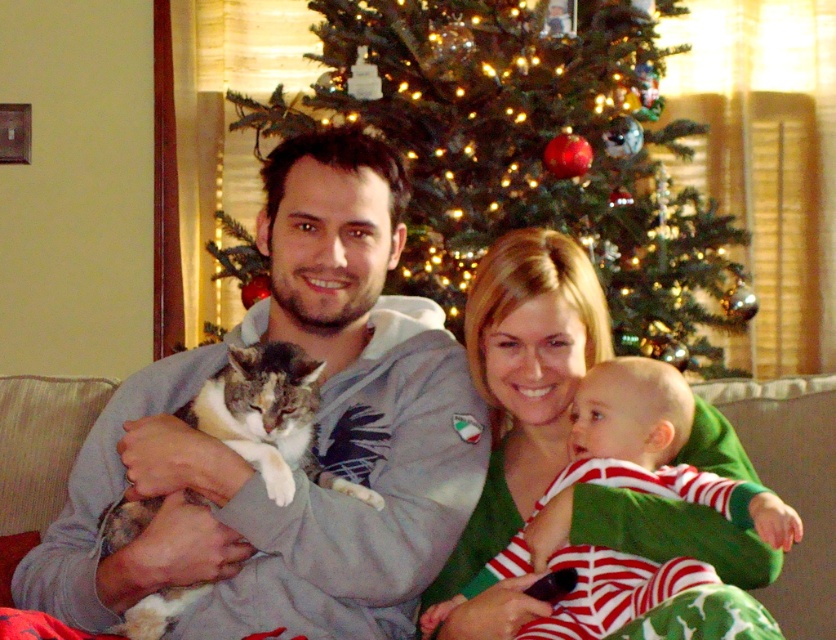
Question: Which point is farther to the camera?

Choices:
 (A) (682, 120)
 (B) (268, 451)
 (C) (67, 566)

Answer: (A)

Question: Which of the following is the closest to the observer?

Choices:
 (A) gray hoodie at center
 (B) calico fur cat at center

Answer: (B)

Question: From the image, what is the correct spatial relationship of green textured christmas tree at center in relation to striped cotton onesie at center?

Choices:
 (A) above
 (B) below

Answer: (A)

Question: Is green textured christmas tree at center above striped cotton onesie at center?

Choices:
 (A) no
 (B) yes

Answer: (B)

Question: Which point is farther to the camera?

Choices:
 (A) (697, 500)
 (B) (253, 342)
 (C) (334, 321)
 (D) (528, 188)

Answer: (D)

Question: Is gray hoodie at center smaller than green textured christmas tree at center?

Choices:
 (A) yes
 (B) no

Answer: (A)